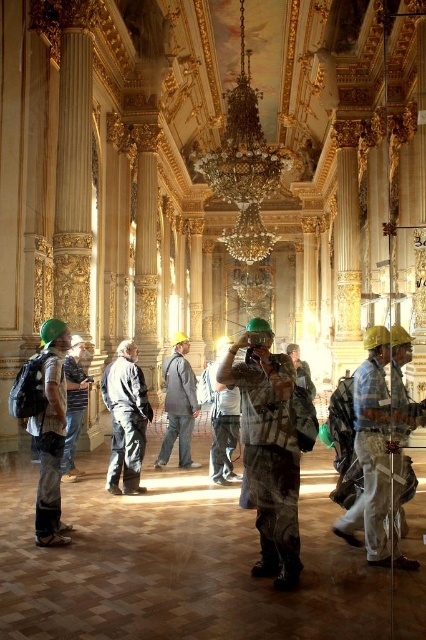
Between camouflage-patterned shirt at center and striped shirt at center, which one has less height?

Standing shorter between the two is striped shirt at center.

Looking at this image, which is more to the right, camouflage-patterned shirt at center or striped shirt at center?

From the viewer's perspective, camouflage-patterned shirt at center appears more on the right side.

Find the location of a particular element. camouflage-patterned shirt at center is located at coordinates (221, 419).

At what (x,y) coordinates should I click in order to perform the action: click on camouflage-patterned shirt at center. Please return your answer as a coordinate pair (x, y). The image size is (426, 640). Looking at the image, I should click on (221, 419).

Can you confirm if gray fabric jacket at center is thinner than camouflage-patterned shirt at center?

Incorrect, gray fabric jacket at center's width is not less than camouflage-patterned shirt at center's.

Consider the image. Can you confirm if gray fabric jacket at center is positioned to the right of camouflage-patterned shirt at center?

Incorrect, gray fabric jacket at center is not on the right side of camouflage-patterned shirt at center.

Which is in front, point (166, 445) or point (226, 428)?

Point (226, 428) is in front.

Identify the location of gray fabric jacket at center. (178, 403).

Does camouflage fabric shirt at center have a lesser width compared to gray fabric jacket at center?

Yes, camouflage fabric shirt at center is thinner than gray fabric jacket at center.

Can you confirm if camouflage fabric shirt at center is bigger than gray fabric jacket at center?

No.

You are a GUI agent. You are given a task and a screenshot of the screen. Output one action in this format:
    pyautogui.click(x=<x>, y=<y>)
    Task: Click on the camouflage fabric shirt at center
    The image size is (426, 640).
    Given the screenshot: What is the action you would take?
    pyautogui.click(x=267, y=449)